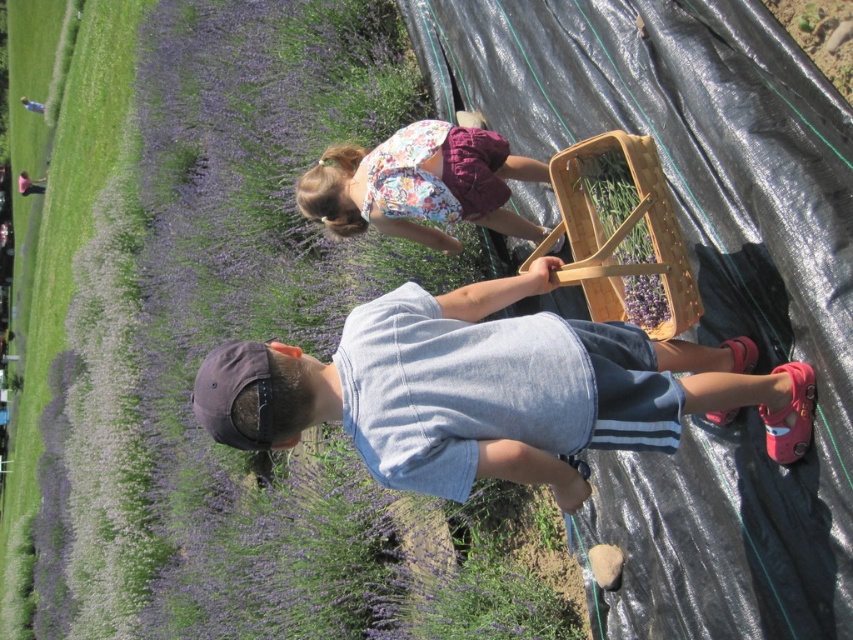
You are a photographer trying to capture the lavender field scene. You want to ensure that both the purple soft lavender at upper left and the floral fabric dress at center are visible in your shot. Given their sizes, which object should you focus on to include both in the frame?

The purple soft lavender at upper left is larger in size than the floral fabric dress at center, so focusing on the lavender at upper left would allow both objects to fit within the frame more effectively.

You are a photographer trying to capture the boy in the denim shorts at center without the purple soft lavender at upper left blocking the view. Can you adjust your camera angle to achieve this?

The purple soft lavender at upper left is positioned over denim shorts at center, so lowering the camera angle would allow you to capture the denim shorts at center without the lavender blocking the view.